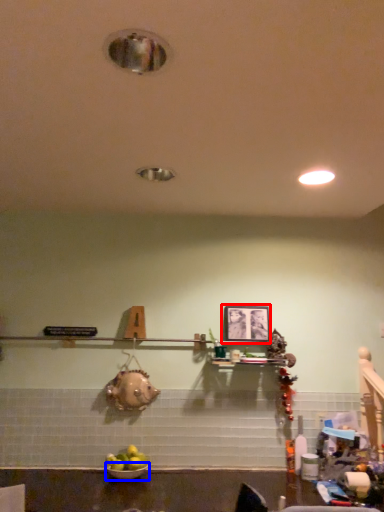
Question: Which point is further to the camera, picture frame (highlighted by a red box) or bowl (highlighted by a blue box)?

Choices:
 (A) picture frame
 (B) bowl

Answer: (A)